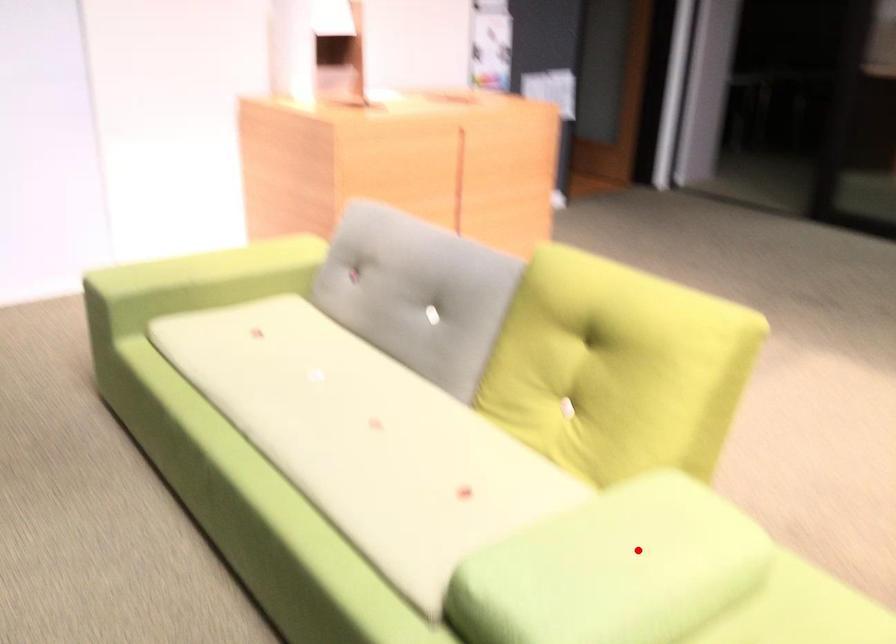
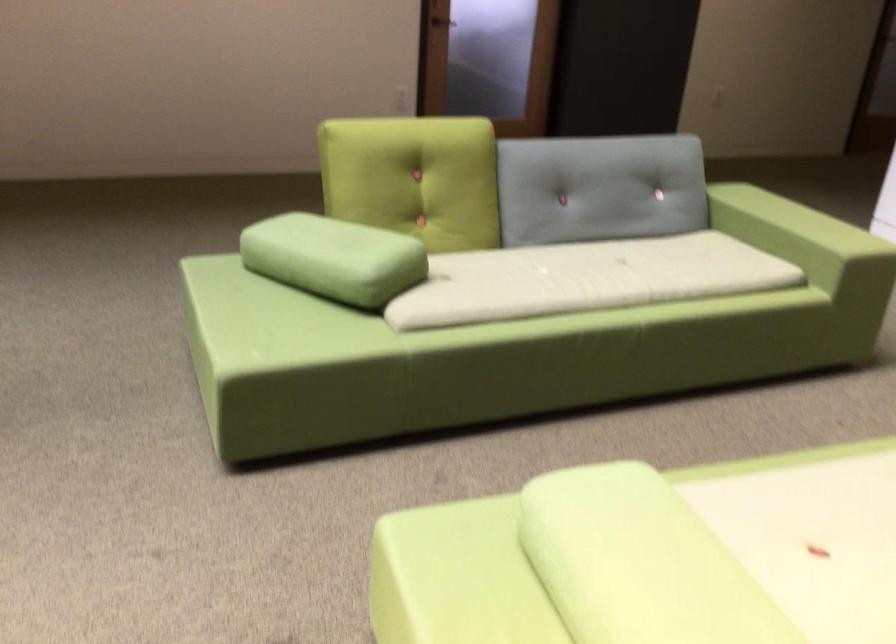
The point at the highlighted location is marked in the first image. Where is the corresponding point in the second image?

(639, 563)